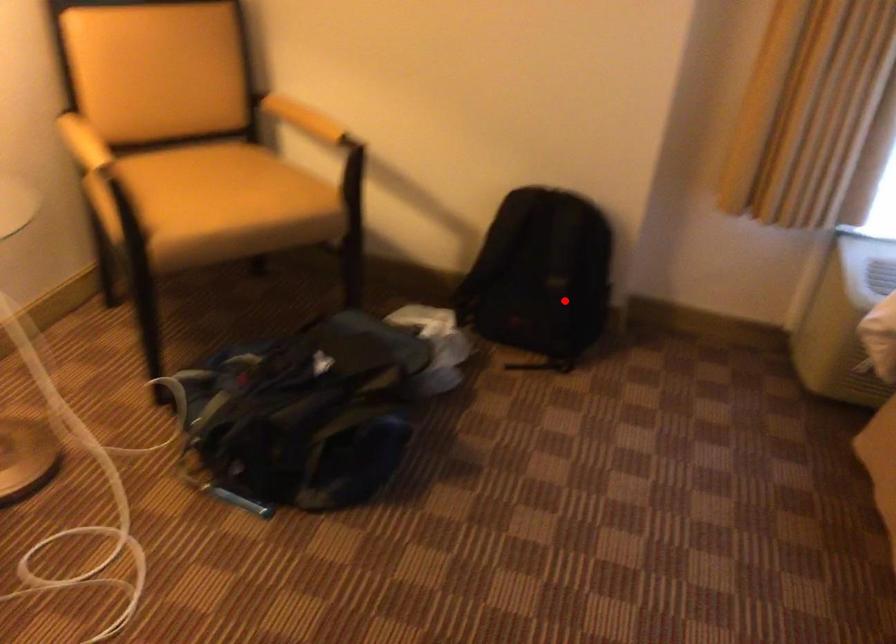
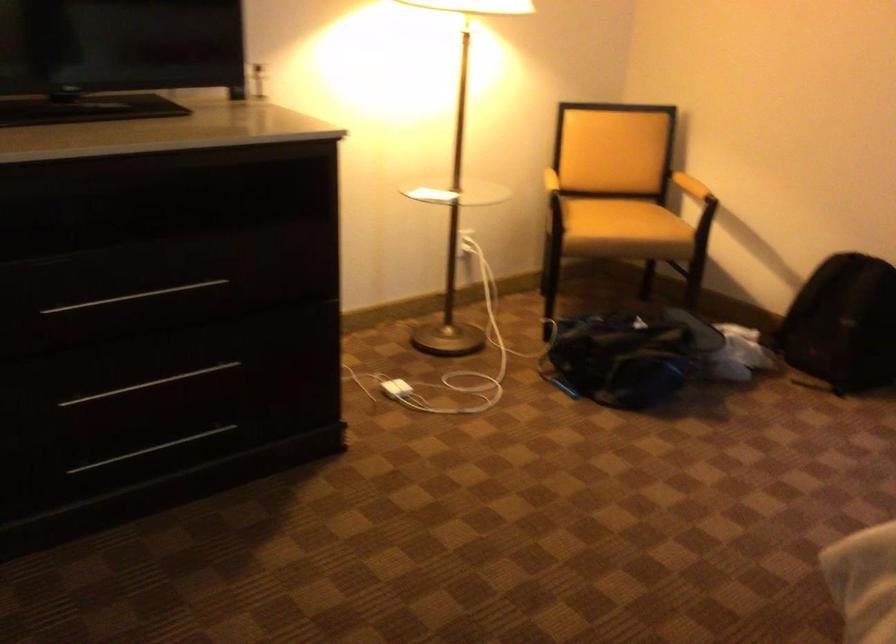
Question: A red point is marked in image1. In image2, is the corresponding 3D point closer to the camera or farther? Reply with the corresponding letter.

Choices:
 (A) The corresponding 3D point is closer.
 (B) The corresponding 3D point is farther.

Answer: (B)